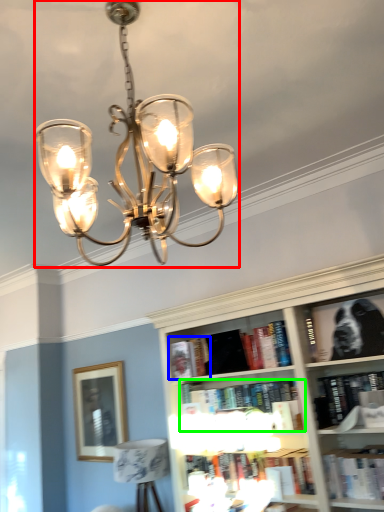
Question: Which is nearer to the lamp (highlighted by a red box)? book (highlighted by a blue box) or book (highlighted by a green box).

Choices:
 (A) book
 (B) book

Answer: (B)